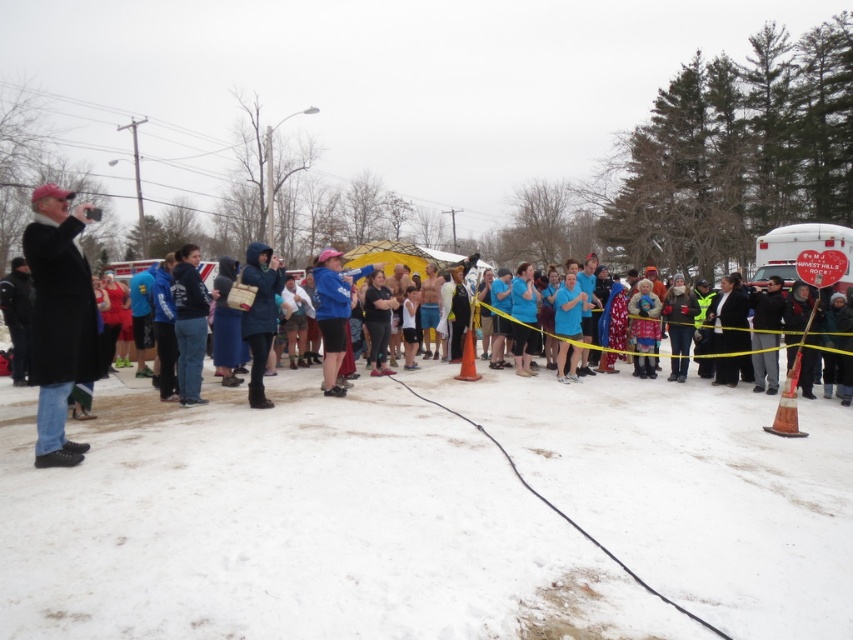
From the picture: You are organizing a photo shoot in the winter scene described. You have two models dressed in a black wool coat at left and a dark blue hoodie at center. To ensure both models are visible in the frame, which model should be positioned closer to the camera?

The dark blue hoodie at center should be positioned closer to the camera because the black wool coat at left might be wider and could block the view of the dark blue hoodie at center if they are both at the same distance.

You are a photographer trying to capture a shot of the matte blue coat at center while standing on the white powdery snow at lower center. Can you comfortably take the photo without moving your feet? Explain your reasoning based on the distance between them.

The distance between the white powdery snow at lower center and the matte blue coat at center is 12.01 feet. Since 12 feet is a reasonable distance for a photographer to capture a clear shot without needing to move their feet, it is possible to take the photo comfortably.

You are a photographer at the event and want to capture a shot of the point marked at coordinates (38, 278). If your camera has a maximum zoom range of 20 feet, can you clearly capture that point without moving closer?

The distance of point (38, 278) from camera is 18.29 feet, so yes, the camera can clearly capture that point since its maximum zoom range of 20 feet exceeds the distance.